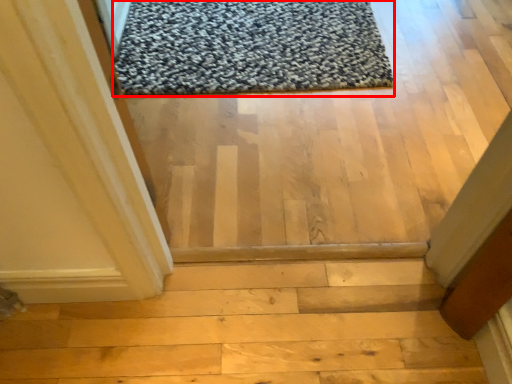
Question: From the image's perspective, what is the correct spatial relationship of mat (annotated by the red box) in relation to stairwell?

Choices:
 (A) above
 (B) below

Answer: (A)